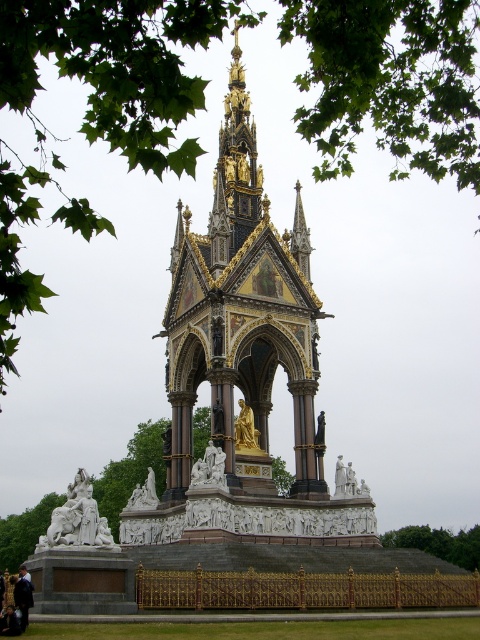
Does gold/gilded stone tower at center have a lesser width compared to white marble sculpture at lower left?

No, gold/gilded stone tower at center is not thinner than white marble sculpture at lower left.

Measure the distance from gold/gilded stone tower at center to white marble sculpture at lower left.

They are 95.72 feet apart.

Locate an element on the screen. The height and width of the screenshot is (640, 480). gold/gilded stone tower at center is located at coordinates (241, 317).

Find the location of a particular element. gold/gilded stone tower at center is located at coordinates (241, 317).

Can you confirm if gold/gilded stone tower at center is positioned to the left of white marble statue at center?

Incorrect, gold/gilded stone tower at center is not on the left side of white marble statue at center.

How much distance is there between gold/gilded stone tower at center and white marble statue at center?

gold/gilded stone tower at center and white marble statue at center are 19.33 meters apart.

Who is more distant from viewer, (250, 234) or (215, 477)?

Positioned behind is point (250, 234).

Identify the location of gold/gilded stone tower at center. (241, 317).

How far apart are green leafy tree at upper center and white marble statue at center?

green leafy tree at upper center and white marble statue at center are 44.78 meters apart from each other.

Who is more forward, (109, 51) or (219, 467)?

Point (109, 51) is more forward.

Describe the element at coordinates (389, 81) in the screenshot. I see `green leafy tree at upper center` at that location.

I want to click on green leafy tree at upper center, so click(389, 81).